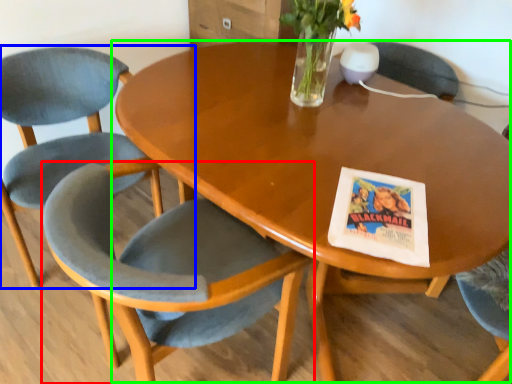
Question: Estimate the real-world distances between objects in this image. Which object is closer to chair (highlighted by a red box), chair (highlighted by a blue box) or coffee table (highlighted by a green box)?

Choices:
 (A) chair
 (B) coffee table

Answer: (B)